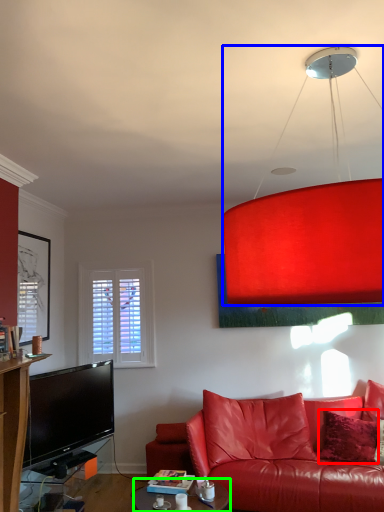
Question: Based on their relative distances, which object is nearer to pillow (highlighted by a red box)? Choose from lamp (highlighted by a blue box) and table (highlighted by a green box).

Choices:
 (A) lamp
 (B) table

Answer: (B)